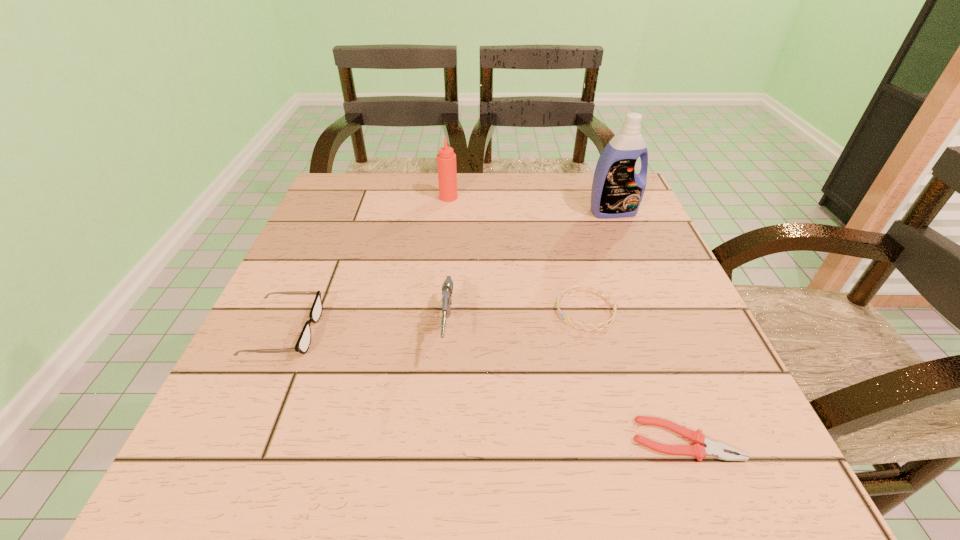
At what (x,y) coordinates should I click in order to perform the action: click on free space at the right edge of the desktop. Please return your answer as a coordinate pair (x, y). The width and height of the screenshot is (960, 540). Looking at the image, I should click on (x=649, y=245).

Locate an element on the screen. This screenshot has width=960, height=540. vacant position at the far left corner of the desktop is located at coordinates (368, 214).

You are a GUI agent. You are given a task and a screenshot of the screen. Output one action in this format:
    pyautogui.click(x=<x>, y=<y>)
    Task: Click on the vacant space at the far right corner of the desktop
    This screenshot has width=960, height=540.
    Given the screenshot: What is the action you would take?
    pyautogui.click(x=588, y=190)

The height and width of the screenshot is (540, 960). In order to click on unoccupied area between the second shortest object and the fifth shortest object in this screenshot , I will do `click(517, 254)`.

The height and width of the screenshot is (540, 960). I want to click on free space that is in between the fourth shortest object and the second shortest object, so click(516, 321).

Identify the location of blank region between the spectacles and the bracelet. (436, 321).

I want to click on vacant area that lies between the Tabasco sauce and the bracelet, so click(x=517, y=254).

You are a GUI agent. You are given a task and a screenshot of the screen. Output one action in this format:
    pyautogui.click(x=<x>, y=<y>)
    Task: Click on the vacant area that lies between the farthest object and the fourth tallest object
    This screenshot has height=540, width=960.
    Given the screenshot: What is the action you would take?
    pyautogui.click(x=367, y=265)

Find the location of `empty space that is in between the third tallest object and the farthest object`. empty space that is in between the third tallest object and the farthest object is located at coordinates (448, 265).

Locate an element on the screen. vacant area between the second farthest object and the second shortest object is located at coordinates (599, 261).